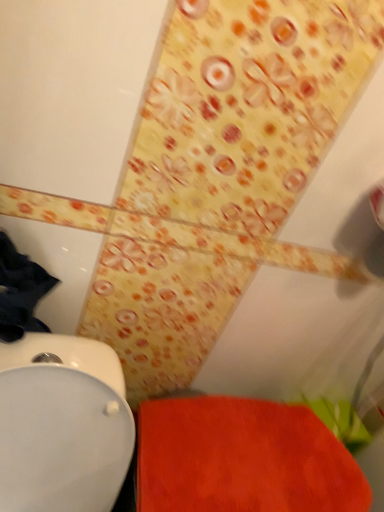
Question: From the image's perspective, is white glossy toilet at lower left located beneath orange fabric bath mat at lower right?

Choices:
 (A) no
 (B) yes

Answer: (B)

Question: Does white glossy toilet at lower left come in front of orange fabric bath mat at lower right?

Choices:
 (A) yes
 (B) no

Answer: (A)

Question: From a real-world perspective, is white glossy toilet at lower left positioned over orange fabric bath mat at lower right based on gravity?

Choices:
 (A) yes
 (B) no

Answer: (B)

Question: Is white glossy toilet at lower left looking in the opposite direction of orange fabric bath mat at lower right?

Choices:
 (A) no
 (B) yes

Answer: (A)

Question: Considering the relative sizes of white glossy toilet at lower left and orange fabric bath mat at lower right in the image provided, is white glossy toilet at lower left thinner than orange fabric bath mat at lower right?

Choices:
 (A) no
 (B) yes

Answer: (A)

Question: Considering the relative sizes of white glossy toilet at lower left and orange fabric bath mat at lower right in the image provided, is white glossy toilet at lower left wider than orange fabric bath mat at lower right?

Choices:
 (A) no
 (B) yes

Answer: (B)

Question: Is orange fabric bath mat at lower right turned away from white glossy toilet at lower left?

Choices:
 (A) yes
 (B) no

Answer: (B)

Question: Considering the relative sizes of orange fabric bath mat at lower right and white glossy toilet at lower left in the image provided, is orange fabric bath mat at lower right shorter than white glossy toilet at lower left?

Choices:
 (A) yes
 (B) no

Answer: (A)

Question: Is orange fabric bath mat at lower right closer to camera compared to white glossy toilet at lower left?

Choices:
 (A) no
 (B) yes

Answer: (A)

Question: Is orange fabric bath mat at lower right taller than white glossy toilet at lower left?

Choices:
 (A) yes
 (B) no

Answer: (B)

Question: Is orange fabric bath mat at lower right placed right next to white glossy toilet at lower left?

Choices:
 (A) yes
 (B) no

Answer: (B)

Question: Considering the relative sizes of orange fabric bath mat at lower right and white glossy toilet at lower left in the image provided, is orange fabric bath mat at lower right thinner than white glossy toilet at lower left?

Choices:
 (A) no
 (B) yes

Answer: (B)

Question: In the image, is orange fabric bath mat at lower right positioned in front of or behind white glossy toilet at lower left?

Choices:
 (A) behind
 (B) front

Answer: (A)